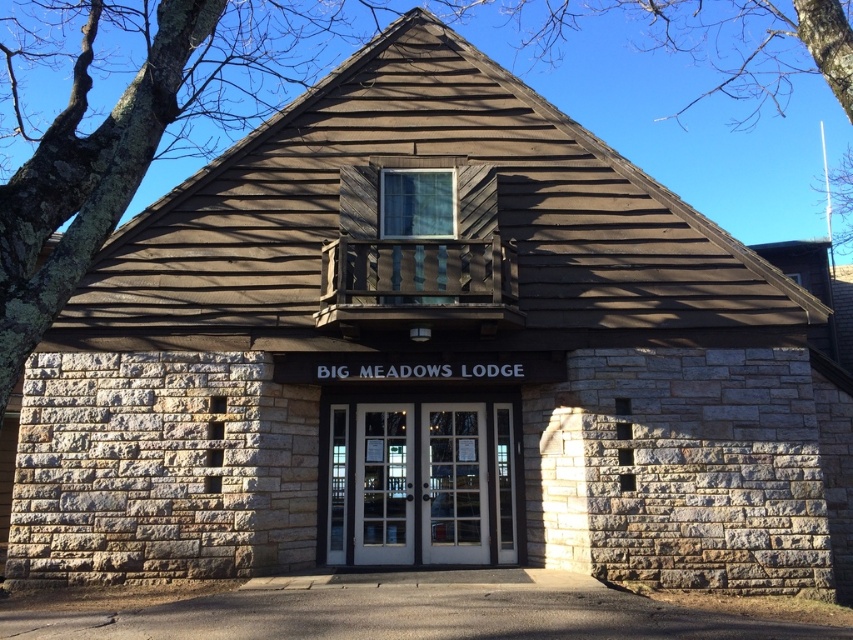
You are standing in front of Big Meadows Lodge and want to enter through the white glass door at center. To your left, there is a brown wood tree at upper center. Which direction should you turn to face the tree while approaching the door?

You should turn to your right to face the brown wood tree at upper center since it is located to the right of the white glass door at center.